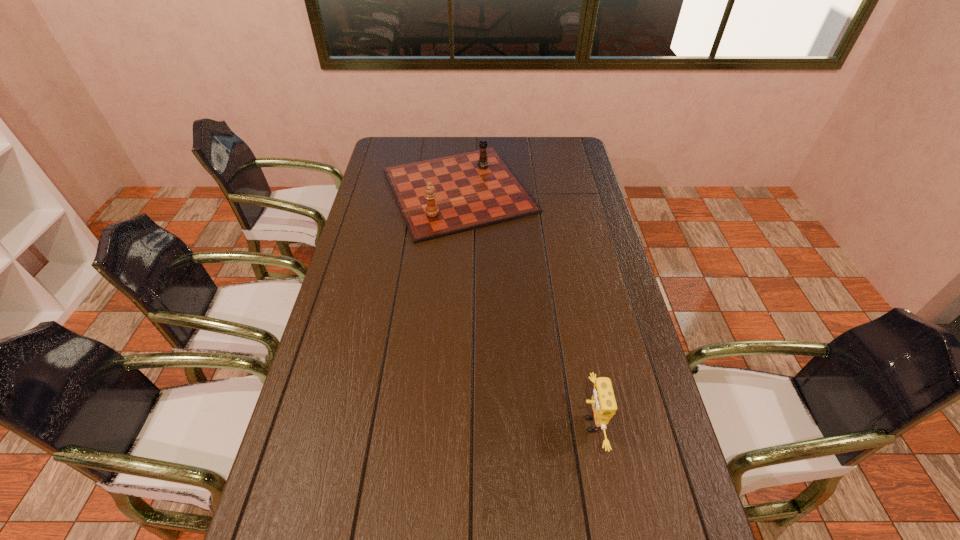
Find the location of a particular element. Image resolution: width=960 pixels, height=540 pixels. the farther object is located at coordinates (442, 196).

At what (x,y) coordinates should I click in order to perform the action: click on gameboard. Please return your answer as a coordinate pair (x, y). This screenshot has height=540, width=960. Looking at the image, I should click on point(442,196).

I want to click on the nearer object, so click(x=603, y=404).

At what (x,y) coordinates should I click in order to perform the action: click on sponge. Please return your answer as a coordinate pair (x, y). Looking at the image, I should click on (603, 404).

At what (x,y) coordinates should I click in order to perform the action: click on free space located on the front of the farther object. Please return your answer as a coordinate pair (x, y). Looking at the image, I should click on (450, 331).

This screenshot has height=540, width=960. Find the location of `free space located on the face of the sponge`. free space located on the face of the sponge is located at coordinates (459, 424).

Identify the location of vacant space positioned on the face of the sponge. (523, 424).

Identify the location of vacant space located on the face of the sponge. The width and height of the screenshot is (960, 540). (479, 424).

The image size is (960, 540). What are the coordinates of `object that is at the far edge` in the screenshot? It's located at (442, 196).

Image resolution: width=960 pixels, height=540 pixels. I want to click on object situated at the left edge, so click(x=442, y=196).